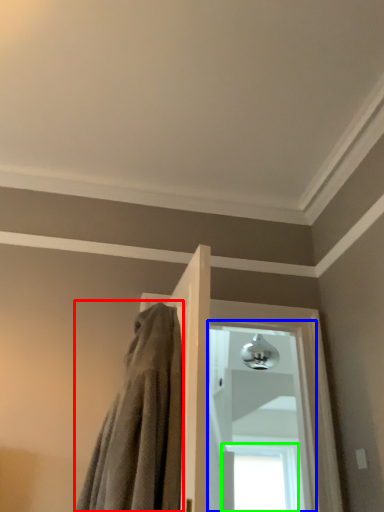
Question: Which is farther away from bath towel (highlighted by a red box)? window (highlighted by a blue box) or window (highlighted by a green box)?

Choices:
 (A) window
 (B) window

Answer: (B)